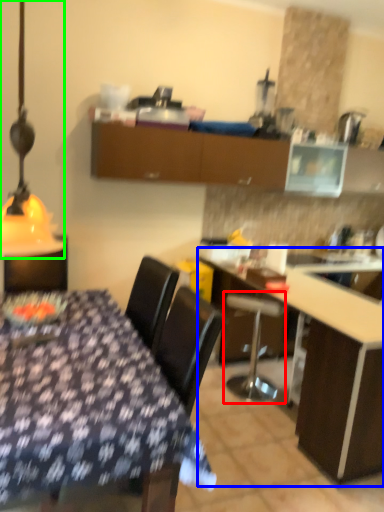
Question: Based on their relative distances, which object is farther from bar stool (highlighted by a red box)? Choose from table (highlighted by a blue box) and table lamp (highlighted by a green box).

Choices:
 (A) table
 (B) table lamp

Answer: (B)